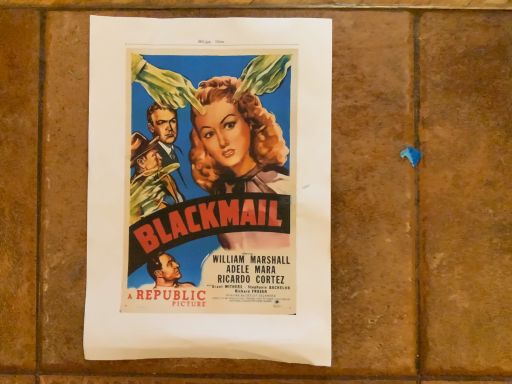
What do you see at coordinates (209, 189) in the screenshot?
I see `matte paper poster at center` at bounding box center [209, 189].

The image size is (512, 384). What are the coordinates of `matte paper poster at center` in the screenshot? It's located at (209, 189).

What is the approximate width of matte paper poster at center?

It is 11.98 inches.

This screenshot has width=512, height=384. Find the location of `matte paper poster at center`. matte paper poster at center is located at coordinates [209, 189].